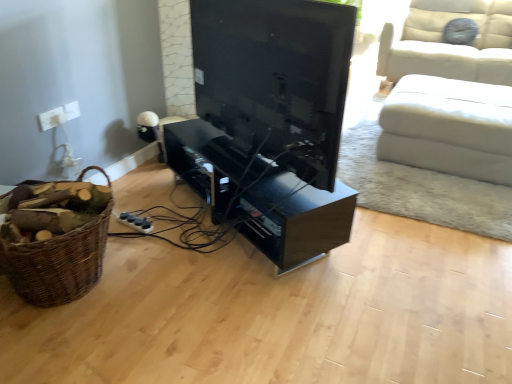
Where is `vacant space to the right of brown woven basket at left`? This screenshot has width=512, height=384. vacant space to the right of brown woven basket at left is located at coordinates (168, 274).